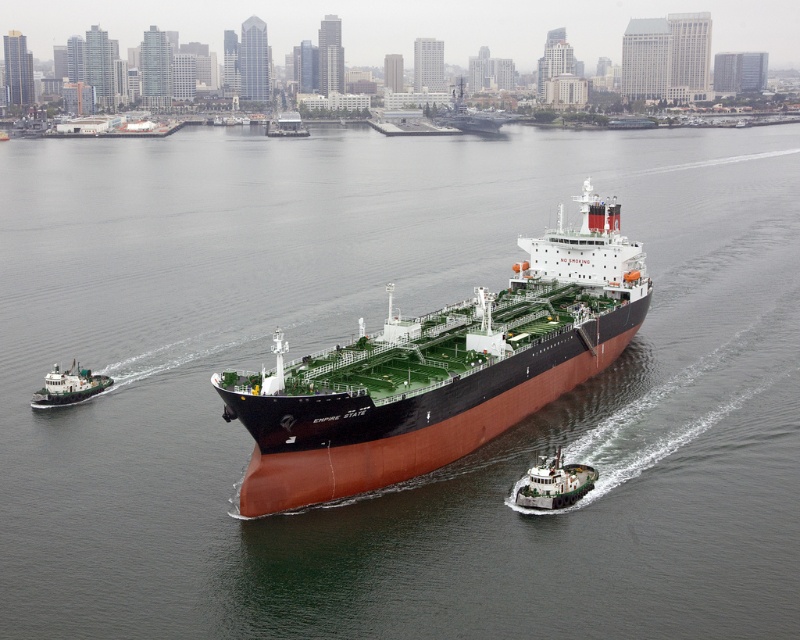
Question: Based on their relative distances, which object is nearer to the rustic metal barge at center?

Choices:
 (A) rustic brown ship at center
 (B) green matte tugboat at lower left

Answer: (A)

Question: Does green matte tugboat at lower left have a smaller size compared to rustic metal barge at center?

Choices:
 (A) yes
 (B) no

Answer: (A)

Question: Which of the following is the farthest from the observer?

Choices:
 (A) (49, 387)
 (B) (564, 506)
 (C) (250, 426)

Answer: (A)

Question: Which object is closer to the camera taking this photo?

Choices:
 (A) green matte tugboat at lower left
 (B) rustic brown ship at center
 (C) green matte tugboat at lower right

Answer: (B)

Question: Can you confirm if rustic brown ship at center is bigger than rustic metal barge at center?

Choices:
 (A) yes
 (B) no

Answer: (A)

Question: Considering the relative positions of rustic brown ship at center and rustic metal barge at center in the image provided, where is rustic brown ship at center located with respect to rustic metal barge at center?

Choices:
 (A) below
 (B) above

Answer: (A)